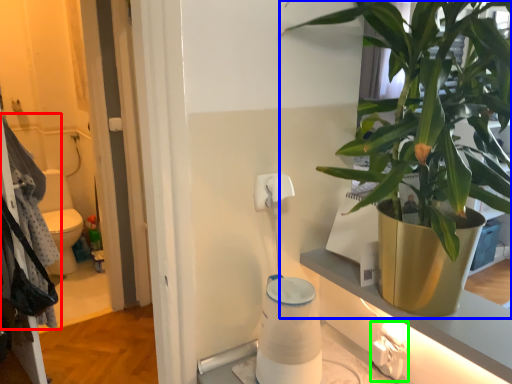
Question: Which object is the farthest from laundry (highlighted by a red box)? Choose among these: houseplant (highlighted by a blue box) or electric outlet (highlighted by a green box).

Choices:
 (A) houseplant
 (B) electric outlet

Answer: (B)